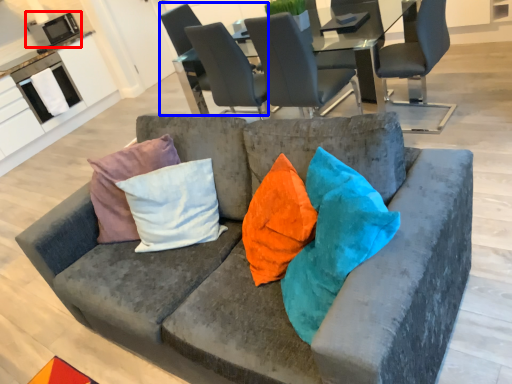
Question: Which object appears farthest to the camera in this image, appliance (highlighted by a red box) or chair (highlighted by a blue box)?

Choices:
 (A) appliance
 (B) chair

Answer: (A)